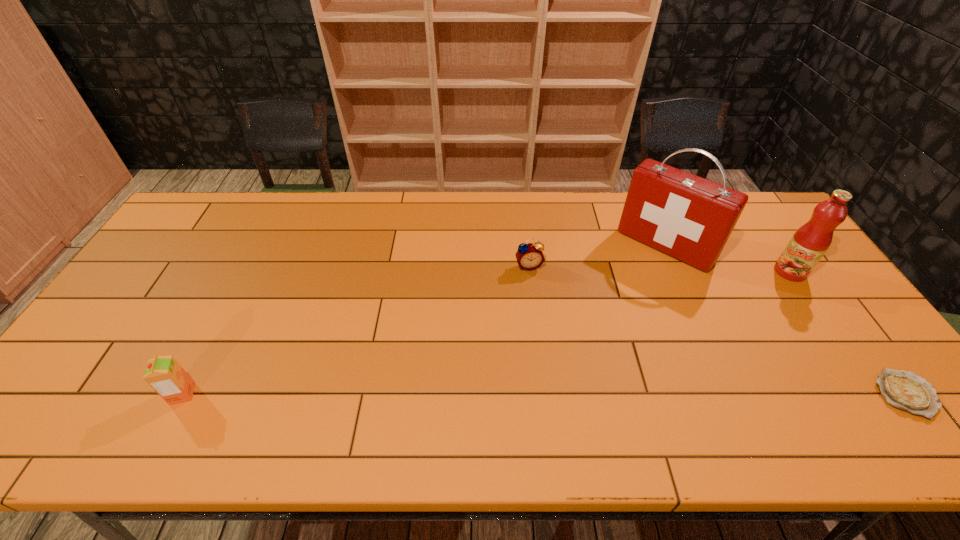
Image resolution: width=960 pixels, height=540 pixels. What are the coordinates of `the third tallest object` in the screenshot? It's located at (164, 374).

This screenshot has height=540, width=960. Find the location of `orange juice`. orange juice is located at coordinates (164, 374).

The height and width of the screenshot is (540, 960). I want to click on the shortest object, so click(905, 390).

Locate an element on the screen. This screenshot has width=960, height=540. the tallest object is located at coordinates (690, 218).

Where is `the first-aid kit`? the first-aid kit is located at coordinates (690, 218).

At what (x,y) coordinates should I click in order to perform the action: click on fruit juice. Please return your answer as a coordinate pair (x, y). Image resolution: width=960 pixels, height=540 pixels. Looking at the image, I should click on (809, 243).

You are a GUI agent. You are given a task and a screenshot of the screen. Output one action in this format:
    pyautogui.click(x=<x>, y=<y>)
    Task: Click on the alarm clock
    The width and height of the screenshot is (960, 540).
    Given the screenshot: What is the action you would take?
    tap(529, 256)

You are a GUI agent. You are given a task and a screenshot of the screen. Output one action in this format:
    pyautogui.click(x=<x>, y=<y>)
    Task: Click on the second object from left to right
    This screenshot has height=540, width=960.
    Given the screenshot: What is the action you would take?
    pyautogui.click(x=529, y=256)

Find the location of a particular element. This screenshot has width=960, height=540. vacant position located 0.400m on the right of the third shortest object is located at coordinates (365, 394).

Image resolution: width=960 pixels, height=540 pixels. Identify the location of blank area located on the left of the quiche. (798, 394).